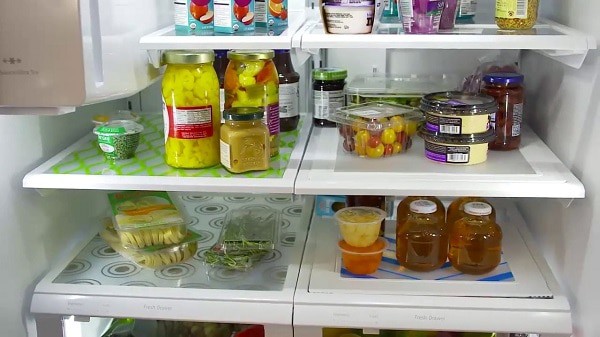
The width and height of the screenshot is (600, 337). What are the coordinates of `shelves` in the screenshot? It's located at (383, 183), (458, 38), (243, 41), (213, 180), (216, 301), (414, 306).